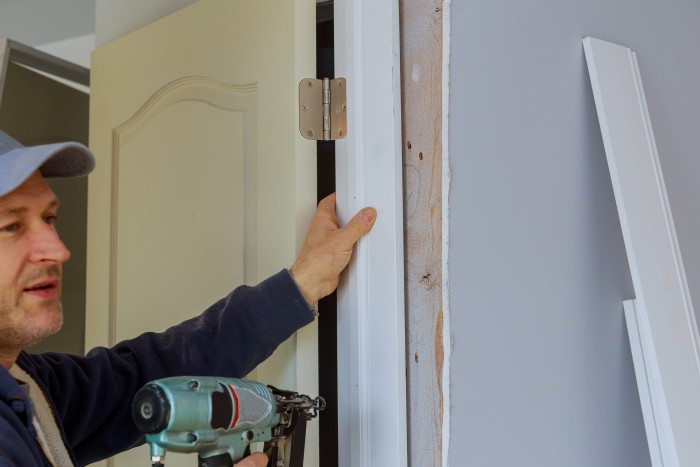
Find the location of a particular element. This screenshot has width=700, height=467. door frame uninstalled is located at coordinates pyautogui.click(x=379, y=165), pyautogui.click(x=636, y=160), pyautogui.click(x=376, y=153).